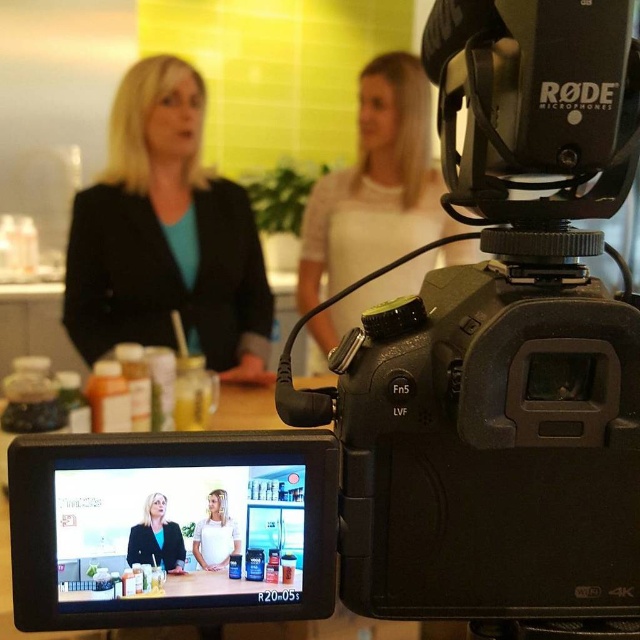
Can you confirm if matte black camera at upper right is positioned to the right of matte black blazer at center?

Indeed, matte black camera at upper right is positioned on the right side of matte black blazer at center.

Between matte black camera at upper right and matte black blazer at center, which one appears on the right side from the viewer's perspective?

Positioned to the right is matte black camera at upper right.

Who is more distant from viewer, [429,253] or [179,557]?

Positioned behind is point [429,253].

Identify the location of matte black camera at upper right. (376, 186).

At what (x,y) coordinates should I click in order to perform the action: click on black matte blazer at left. Please return your answer as a coordinate pair (x, y). Looking at the image, I should click on (164, 236).

Based on the photo, who is positioned more to the left, black matte blazer at left or matte black camera at upper right?

From the viewer's perspective, black matte blazer at left appears more on the left side.

This screenshot has width=640, height=640. What are the coordinates of `black matte blazer at left` in the screenshot? It's located at (164, 236).

At what (x,y) coordinates should I click in order to perform the action: click on black matte blazer at left. Please return your answer as a coordinate pair (x, y). Looking at the image, I should click on (164, 236).

Is matte black blazer at center wider than white matte shirt at center?

Correct, the width of matte black blazer at center exceeds that of white matte shirt at center.

Is matte black blazer at center smaller than white matte shirt at center?

No.

Does point (132, 557) come closer to viewer compared to point (195, 550)?

Yes, point (132, 557) is closer to viewer.

The image size is (640, 640). In order to click on matte black blazer at center in this screenshot , I will do `click(156, 538)`.